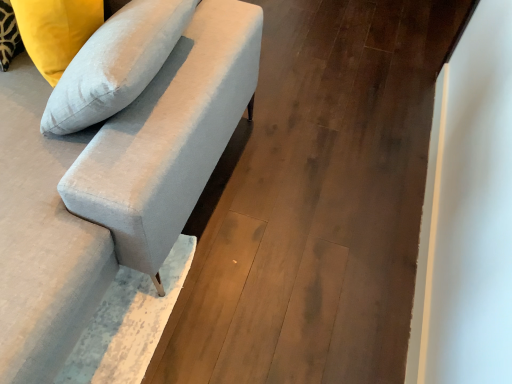
Question: Is point (48, 258) closer or farther from the camera than point (354, 147)?

Choices:
 (A) closer
 (B) farther

Answer: (A)

Question: Would you say suede-like gray couch at upper left is to the left or to the right of matte gray sofa at center-left in the picture?

Choices:
 (A) left
 (B) right

Answer: (A)

Question: Which is nearer to the satin white pillow at upper left?

Choices:
 (A) suede-like gray couch at upper left
 (B) matte gray sofa at center-left

Answer: (A)

Question: Considering the real-world distances, which object is farthest from the matte gray sofa at center-left?

Choices:
 (A) satin white pillow at upper left
 (B) suede-like gray couch at upper left

Answer: (A)